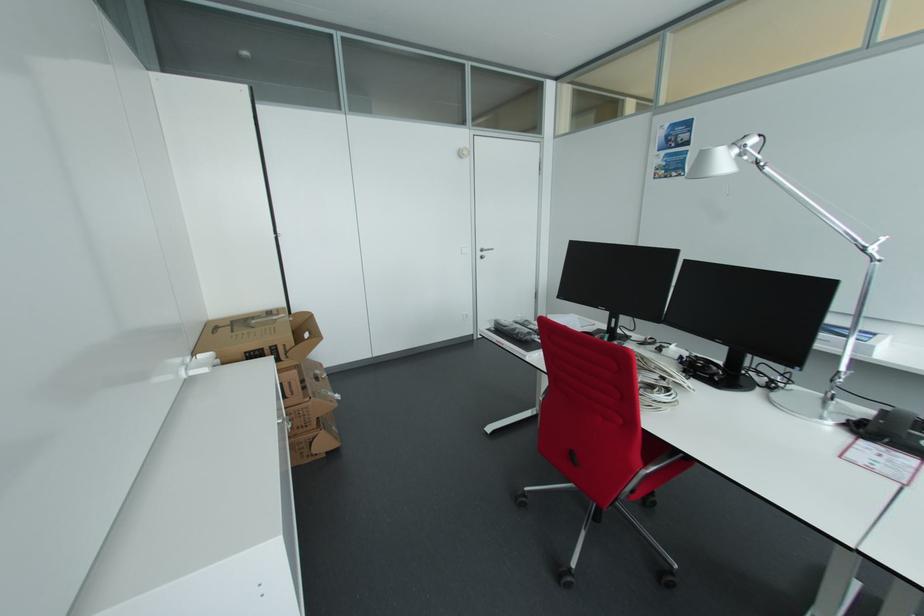
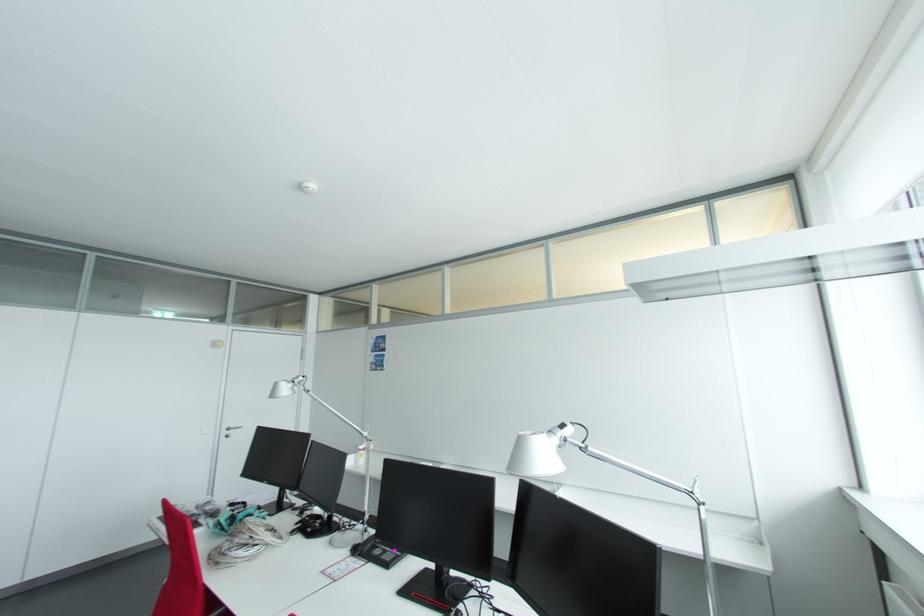
The point at (484, 252) is marked in the first image. Where is the corresponding point in the second image?

(232, 430)